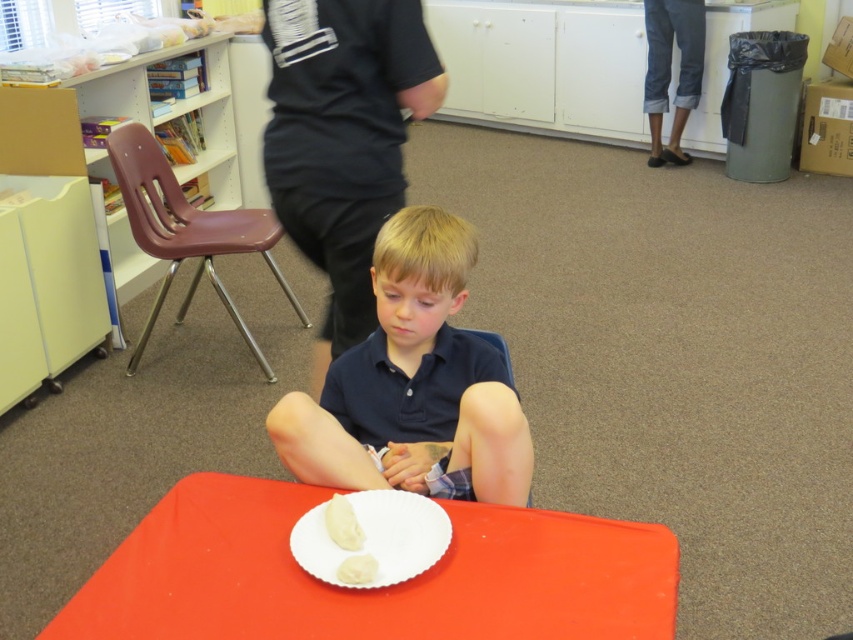
Question: Which point is farther to the camera?

Choices:
 (A) (350, 570)
 (B) (346, 403)

Answer: (B)

Question: Is dark blue shirt at center bigger than white creamy cake at center?

Choices:
 (A) yes
 (B) no

Answer: (A)

Question: Which point is closer to the camera taking this photo?

Choices:
 (A) (350, 540)
 (B) (432, 244)

Answer: (A)

Question: Is dark blue shirt at center above white paper plate at center?

Choices:
 (A) yes
 (B) no

Answer: (A)

Question: Observing the image, what is the correct spatial positioning of white matte dumpling at center in reference to white creamy cake at center?

Choices:
 (A) left
 (B) right

Answer: (A)

Question: Which object appears closest to the camera in this image?

Choices:
 (A) smooth plastic table at center
 (B) white matte dumpling at center
 (C) dark blue shirt at center
 (D) white creamy cake at center

Answer: (A)